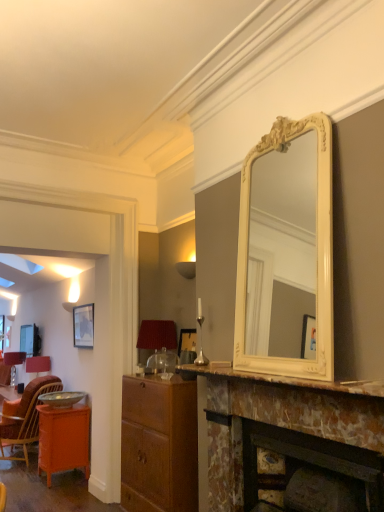
Locate an element on the screen. Image resolution: width=384 pixels, height=512 pixels. free space on the front side of orange glossy cabinet at lower left is located at coordinates (45, 493).